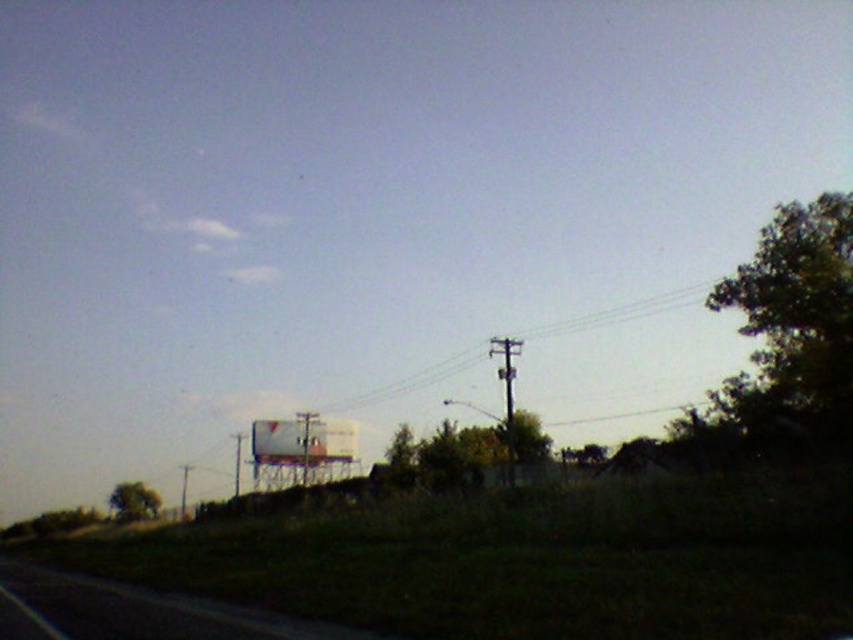
Can you confirm if asphalt road at lower left is thinner than smooth wooden pole at center right?

Incorrect, asphalt road at lower left's width is not less than smooth wooden pole at center right's.

Is asphalt road at lower left below smooth wooden pole at center right?

No, asphalt road at lower left is not below smooth wooden pole at center right.

Which is in front, point (167, 618) or point (508, 432)?

Point (167, 618) is in front.

Image resolution: width=853 pixels, height=640 pixels. I want to click on asphalt road at lower left, so click(x=146, y=611).

Is asphalt road at lower left bigger than metallic wire at center?

Actually, asphalt road at lower left might be smaller than metallic wire at center.

Does asphalt road at lower left have a lesser height compared to metallic wire at center?

Correct, asphalt road at lower left is not as tall as metallic wire at center.

Between point (265, 637) and point (373, 403), which one is positioned behind?

Positioned behind is point (373, 403).

At what (x,y) coordinates should I click in order to perform the action: click on asphalt road at lower left. Please return your answer as a coordinate pair (x, y). This screenshot has width=853, height=640. Looking at the image, I should click on (146, 611).

Can you confirm if metallic wire at center is shorter than smooth wooden pole at center right?

No, metallic wire at center is not shorter than smooth wooden pole at center right.

Can you confirm if metallic wire at center is positioned to the right of smooth wooden pole at center right?

Incorrect, metallic wire at center is not on the right side of smooth wooden pole at center right.

Does point (607, 310) come behind point (492, 348)?

Yes, it is.

You are a GUI agent. You are given a task and a screenshot of the screen. Output one action in this format:
    pyautogui.click(x=<x>, y=<y>)
    Task: Click on the metallic wire at center
    This screenshot has width=853, height=640.
    Given the screenshot: What is the action you would take?
    pyautogui.click(x=614, y=316)